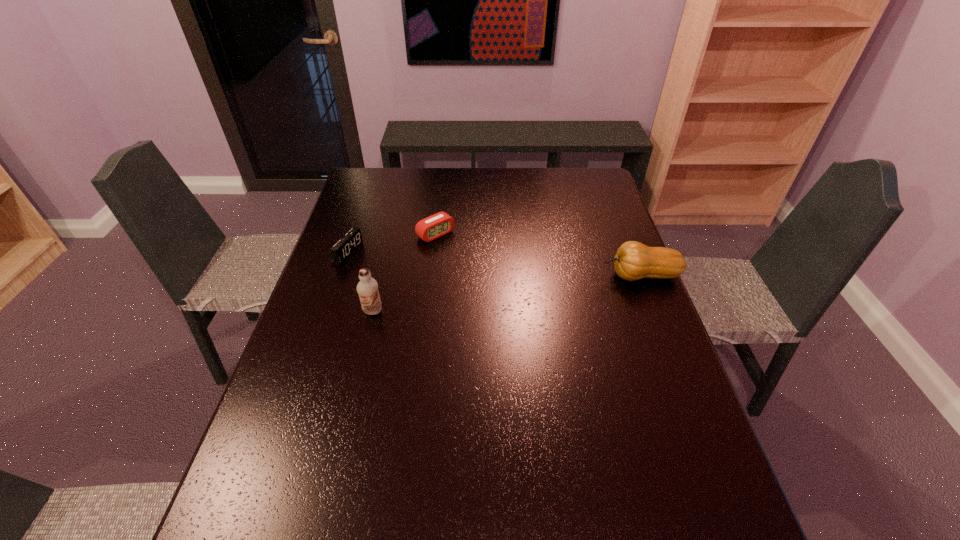
Find the location of a particular element. The image size is (960, 540). free location at the near edge of the desktop is located at coordinates (495, 460).

This screenshot has height=540, width=960. What are the coordinates of `vacant space at the left edge of the desktop` in the screenshot? It's located at (350, 277).

Image resolution: width=960 pixels, height=540 pixels. Find the location of `vacant area at the right edge`. vacant area at the right edge is located at coordinates (643, 373).

You are a GUI agent. You are given a task and a screenshot of the screen. Output one action in this format:
    pyautogui.click(x=<x>, y=<y>)
    Task: Click on the vacant position at the far right corner of the desktop
    This screenshot has height=540, width=960.
    Given the screenshot: What is the action you would take?
    pyautogui.click(x=596, y=195)

At what (x,y) coordinates should I click in order to perform the action: click on free space between the nearest object and the gourd. Please return your answer as a coordinate pair (x, y). This screenshot has width=960, height=540. Looking at the image, I should click on (507, 293).

Identify the location of free area in between the right alarm clock and the left alarm clock. Image resolution: width=960 pixels, height=540 pixels. (392, 244).

At what (x,y) coordinates should I click in order to perform the action: click on vacant area between the chocolate milk and the right alarm clock. Please return your answer as a coordinate pair (x, y). The image size is (960, 540). Looking at the image, I should click on (404, 273).

The height and width of the screenshot is (540, 960). I want to click on free space between the gourd and the third object from left to right, so click(539, 255).

Where is `vacant space that's between the second tallest object and the tallest object`? This screenshot has width=960, height=540. vacant space that's between the second tallest object and the tallest object is located at coordinates (507, 293).

Identify the location of free space between the third object from left to right and the second tallest object. (539, 255).